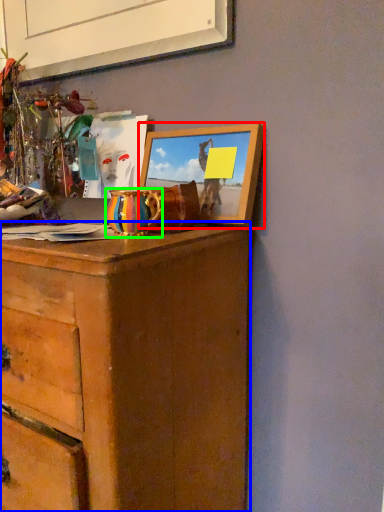
Question: Which is nearer to the picture frame (highlighted by a red box)? chest of drawers (highlighted by a blue box) or vase (highlighted by a green box).

Choices:
 (A) chest of drawers
 (B) vase

Answer: (B)